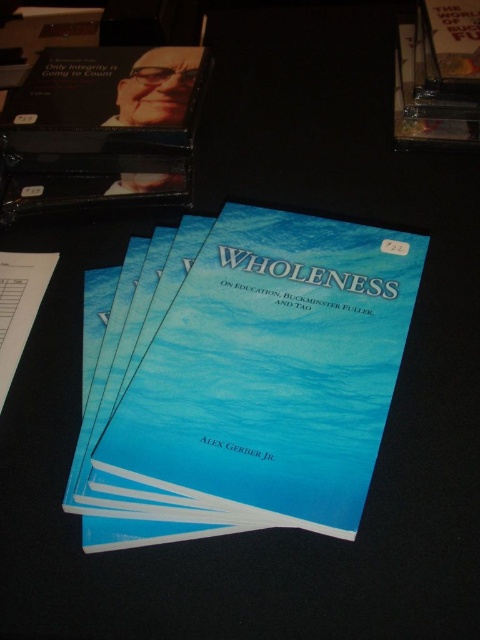
You are standing in front of the book titled WHOLENESS. There are two points marked on its cover at coordinates point (x=280, y=227) and point (x=425, y=128). Which point is closer to you?

Point (x=280, y=227) is closer to the camera than point (x=425, y=128), so the point at (x=280, y=227) is closer to you.

You are organizing books on a shelf and need to place the matte black book at upper left and the gold metallic book at upper right. If you want to arrange them so that the closer one is on the left side of the shelf, which book should you place on the left?

The matte black book at upper left is closer to the viewer, so to have the closer one on the left side of the shelf, you should place the matte black book at upper left on the left side.

You are organizing a library shelf and need to place the blue paper book at center and the matte black book at upper left. Given their sizes, which book should you place first to ensure proper arrangement?

The blue paper book at center should be placed first because it is larger than the matte black book at upper left, allowing for easier positioning on the shelf.